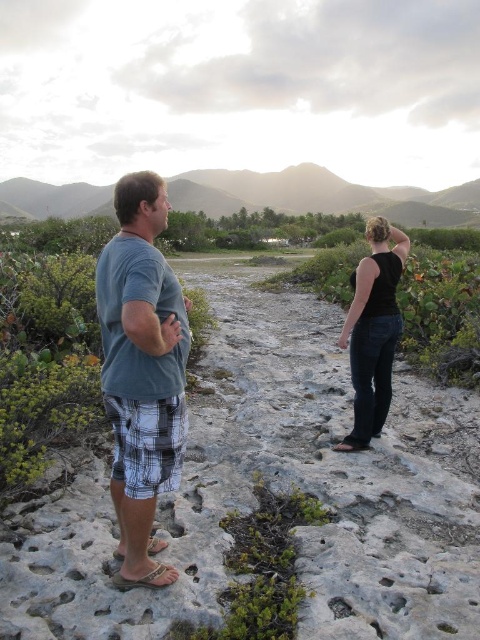
Image resolution: width=480 pixels, height=640 pixels. Describe the element at coordinates (142, 371) in the screenshot. I see `gray cotton shirt at left` at that location.

Is the position of gray cotton shirt at left less distant than that of black denim jeans at center?

Yes, gray cotton shirt at left is closer to the viewer.

Image resolution: width=480 pixels, height=640 pixels. Describe the element at coordinates (142, 371) in the screenshot. I see `gray cotton shirt at left` at that location.

Locate an element on the screen. gray cotton shirt at left is located at coordinates (142, 371).

Does point (376, 531) come behind point (358, 339)?

That is False.

Is gray stone path at center above black denim jeans at center?

Actually, gray stone path at center is below black denim jeans at center.

The width and height of the screenshot is (480, 640). Describe the element at coordinates (274, 486) in the screenshot. I see `gray stone path at center` at that location.

At what (x,y) coordinates should I click in order to perform the action: click on gray stone path at center. Please return your answer as a coordinate pair (x, y). Image resolution: width=480 pixels, height=640 pixels. Looking at the image, I should click on (274, 486).

Describe the element at coordinates (274, 486) in the screenshot. I see `gray stone path at center` at that location.

This screenshot has height=640, width=480. I want to click on gray stone path at center, so coord(274,486).